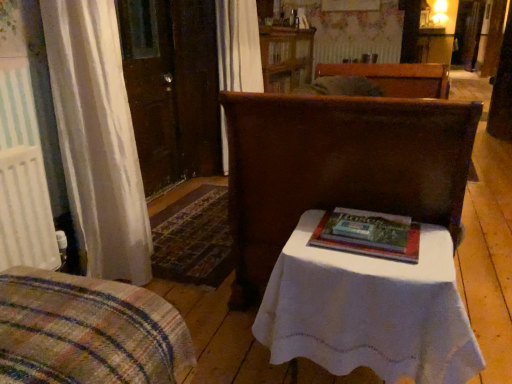
Question: From a real-world perspective, relative to white cloth-covered table at center, is hardcover book at center vertically above or below?

Choices:
 (A) above
 (B) below

Answer: (A)

Question: Is hardcover book at center to the left or to the right of white cloth-covered table at center in the image?

Choices:
 (A) right
 (B) left

Answer: (B)

Question: Which is nearer to the plaid fabric bedspread at lower left, which is counted as the 1th furniture, starting from the left?

Choices:
 (A) white cloth-covered table at center
 (B) wooden cabinet at upper center
 (C) matte brown chair at center, which is the 1th furniture from back to front
 (D) hardcover book at center

Answer: (A)

Question: Considering the real-world distances, which object is closest to the wooden cabinet at upper center?

Choices:
 (A) white cloth-covered table at center
 (B) hardcover book at center
 (C) plaid fabric bedspread at lower left, which is counted as the 1th furniture, starting from the left
 (D) matte brown chair at center, which is the 1th furniture from back to front

Answer: (D)